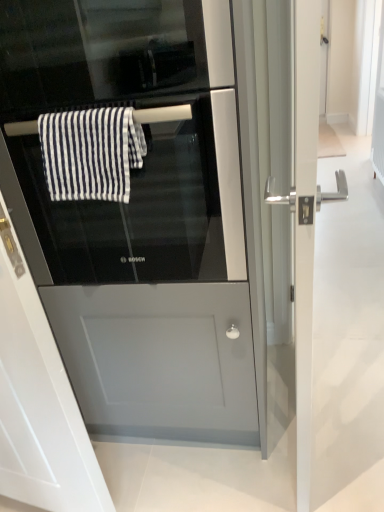
Question: Does black glass oven at center touch black glass screen door at center, placed as the second screen door when sorted from right to left?

Choices:
 (A) no
 (B) yes

Answer: (A)

Question: Is black glass oven at center further to camera compared to black glass screen door at center, placed as the second screen door when sorted from right to left?

Choices:
 (A) no
 (B) yes

Answer: (B)

Question: From the image's perspective, is black glass oven at center above black glass screen door at center, placed as the second screen door when sorted from right to left?

Choices:
 (A) yes
 (B) no

Answer: (A)

Question: Is black glass oven at center bigger than black glass screen door at center, placed as the second screen door when sorted from right to left?

Choices:
 (A) yes
 (B) no

Answer: (A)

Question: Is black glass oven at center wider than black glass screen door at center, placed as the second screen door when sorted from right to left?

Choices:
 (A) yes
 (B) no

Answer: (A)

Question: Based on their sizes in the image, would you say black glass oven at center is bigger or smaller than white striped fabric at center?

Choices:
 (A) big
 (B) small

Answer: (A)

Question: From the image's perspective, is black glass oven at center located above or below white striped fabric at center?

Choices:
 (A) above
 (B) below

Answer: (A)

Question: Is black glass oven at center in front of or behind white striped fabric at center in the image?

Choices:
 (A) behind
 (B) front

Answer: (B)

Question: Looking at their shapes, would you say black glass oven at center is wider or thinner than white striped fabric at center?

Choices:
 (A) wide
 (B) thin

Answer: (A)

Question: From a real-world perspective, is silver metallic door handle at right, positioned as the 1th screen door in right-to-left order, positioned above or below white striped fabric at center?

Choices:
 (A) above
 (B) below

Answer: (B)

Question: From the image's perspective, is silver metallic door handle at right, marked as the 2th screen door in a left-to-right arrangement, above or below white striped fabric at center?

Choices:
 (A) above
 (B) below

Answer: (B)

Question: Relative to white striped fabric at center, is silver metallic door handle at right, positioned as the 1th screen door in right-to-left order, in front or behind?

Choices:
 (A) behind
 (B) front

Answer: (B)

Question: Is point (304, 57) positioned closer to the camera than point (97, 187)?

Choices:
 (A) closer
 (B) farther

Answer: (A)

Question: Is white striped fabric at center inside the boundaries of black glass screen door at center, placed as the second screen door when sorted from right to left, or outside?

Choices:
 (A) inside
 (B) outside

Answer: (B)

Question: From their relative heights in the image, would you say white striped fabric at center is taller or shorter than black glass screen door at center, arranged as the 1th screen door when viewed from the left?

Choices:
 (A) short
 (B) tall

Answer: (A)